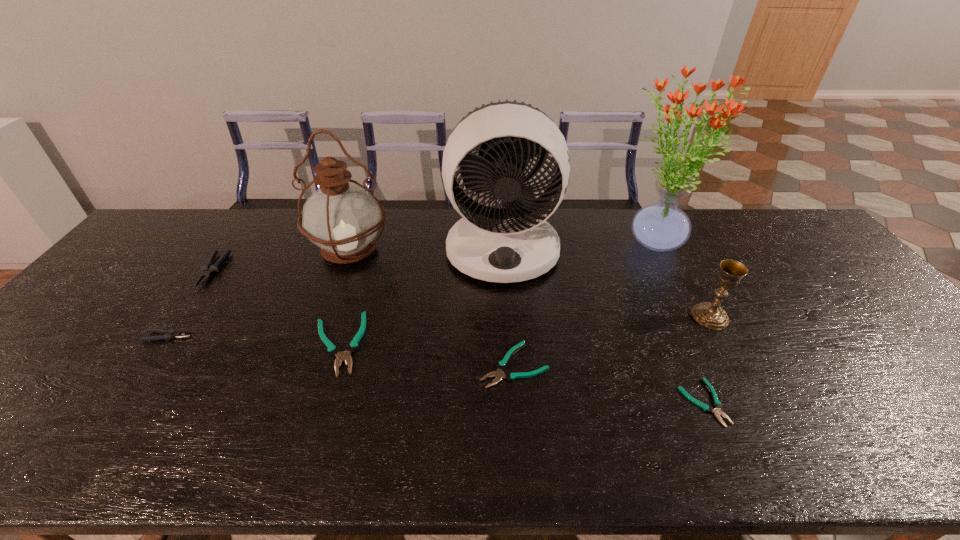
Locate an element on the screen. This screenshot has width=960, height=540. flower arrangement is located at coordinates (662, 226).

Find the location of `gray fan`. gray fan is located at coordinates click(511, 241).

I want to click on oil lamp, so click(x=343, y=219).

At what (x,y) coordinates should I click in order to perform the action: click on chalice. Please return your answer as a coordinate pair (x, y). The width and height of the screenshot is (960, 540). Looking at the image, I should click on (711, 315).

Where is `the sixth shortest object`? Image resolution: width=960 pixels, height=540 pixels. the sixth shortest object is located at coordinates (711, 315).

Find the location of a particular element. This screenshot has height=540, width=960. the fifth tallest object is located at coordinates (208, 268).

Where is `the farthest pliers`? This screenshot has width=960, height=540. the farthest pliers is located at coordinates (208, 268).

The image size is (960, 540). I want to click on the smaller gray pliers, so click(x=171, y=333).

Find the location of `the leftmost teal pliers`. the leftmost teal pliers is located at coordinates (333, 349).

Where is `the biggest teal pliers`? the biggest teal pliers is located at coordinates (333, 349).